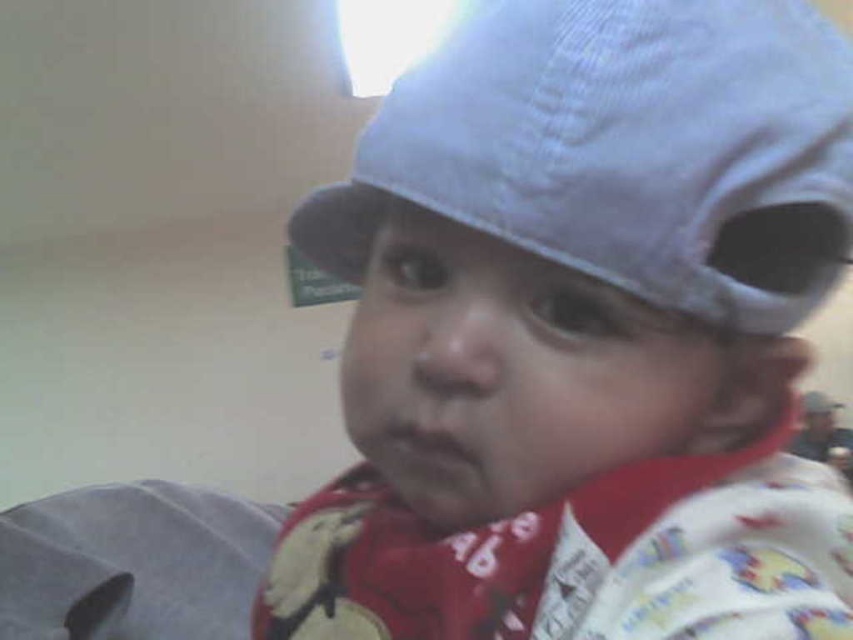
Question: Can you confirm if matte blue cap at center is thinner than blue corduroy baseball cap at upper center?

Choices:
 (A) no
 (B) yes

Answer: (A)

Question: Is matte blue cap at center bigger than blue corduroy baseball cap at upper center?

Choices:
 (A) no
 (B) yes

Answer: (B)

Question: Observing the image, what is the correct spatial positioning of matte blue cap at center in reference to blue corduroy baseball cap at upper center?

Choices:
 (A) above
 (B) below

Answer: (B)

Question: Which of the following is the farthest from the observer?

Choices:
 (A) blue corduroy baseball cap at upper center
 (B) matte blue cap at center

Answer: (A)

Question: Among these points, which one is nearest to the camera?

Choices:
 (A) pyautogui.click(x=490, y=49)
 (B) pyautogui.click(x=486, y=328)

Answer: (A)